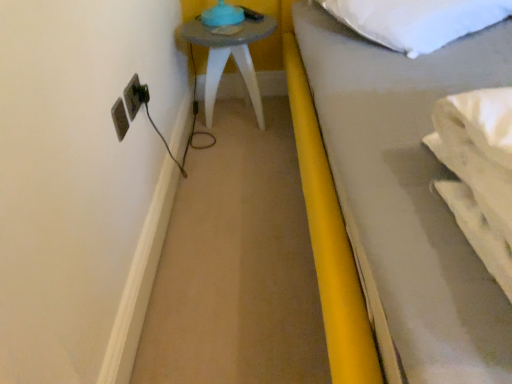
The image size is (512, 384). I want to click on vacant region under matte gray side table at upper left (from a real-world perspective), so click(x=240, y=111).